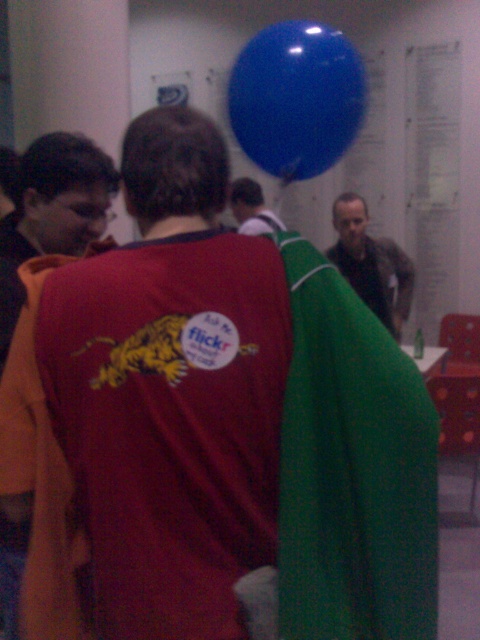
Question: Which object is the farthest from the matte brown jacket at center?

Choices:
 (A) glossy blue balloon at upper center
 (B) smooth gray shirt at center

Answer: (A)

Question: Is glossy blue balloon at upper center bigger than smooth gray shirt at center?

Choices:
 (A) yes
 (B) no

Answer: (B)

Question: Which object is the farthest from the matte brown jacket at center?

Choices:
 (A) matte red shirt at center
 (B) smooth gray shirt at center

Answer: (A)

Question: Is matte red shirt at center smaller than smooth gray shirt at center?

Choices:
 (A) yes
 (B) no

Answer: (A)

Question: Is glossy blue balloon at upper center bigger than matte red shirt at center?

Choices:
 (A) no
 (B) yes

Answer: (A)

Question: Which point is farther to the camera?

Choices:
 (A) (256, 196)
 (B) (104, 170)

Answer: (A)